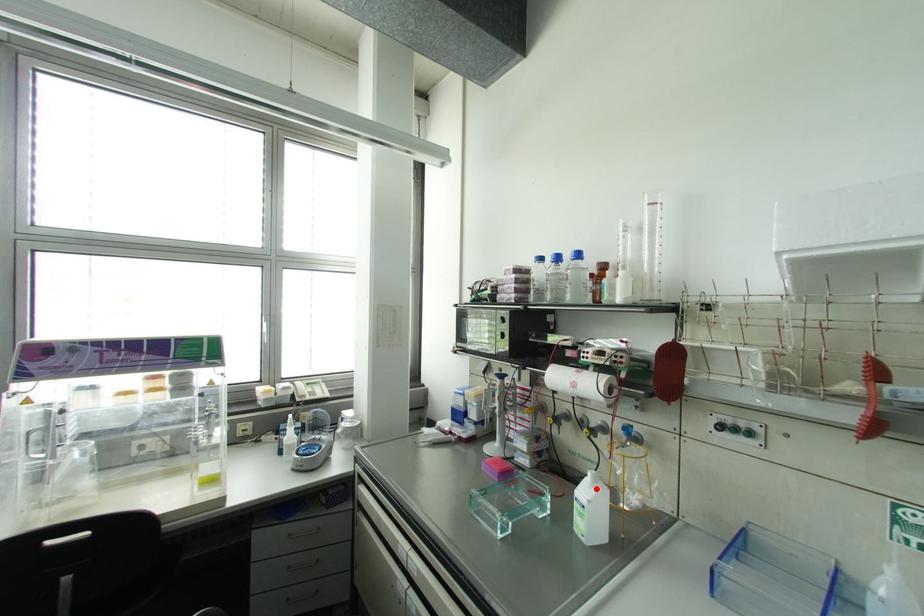
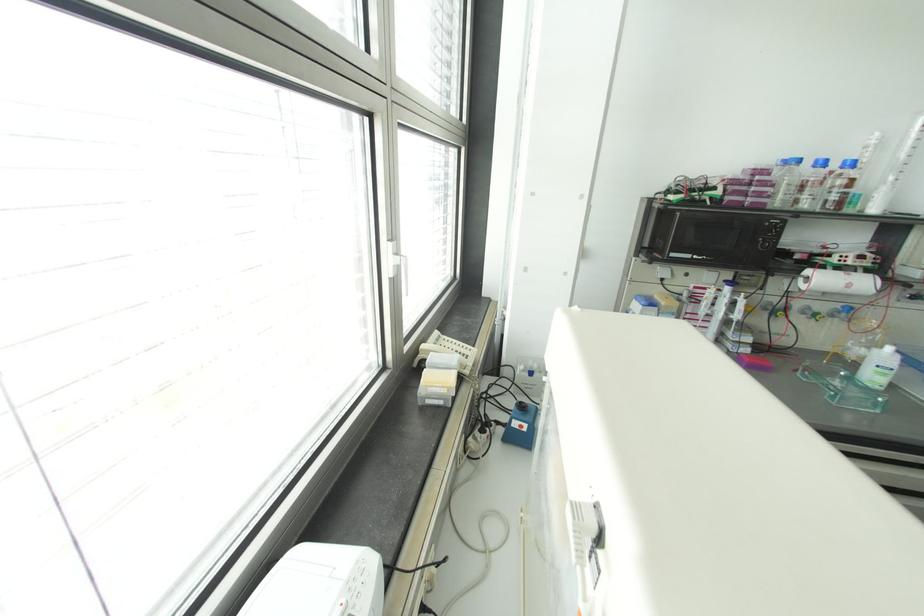
Where in the second image is the point corresponding to the highlighted location from the first image?

(898, 355)